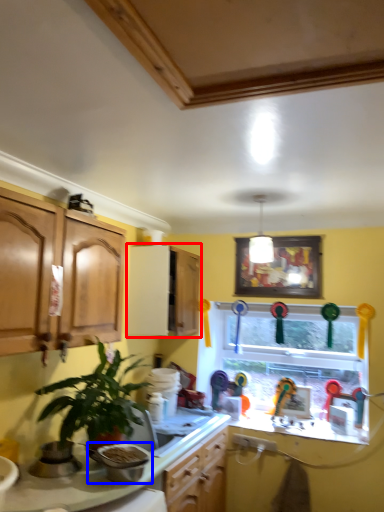
Question: Among these objects, which one is nearest to the camera, cabinetry (highlighted by a red box) or appliance (highlighted by a blue box)?

Choices:
 (A) cabinetry
 (B) appliance

Answer: (B)